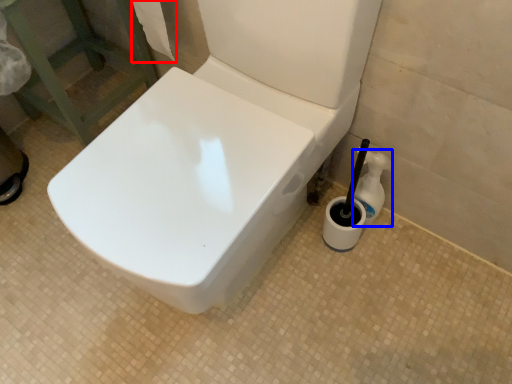
Question: Which of the following is the farthest to the observer, toilet paper (highlighted by a red box) or cleaning product (highlighted by a blue box)?

Choices:
 (A) toilet paper
 (B) cleaning product

Answer: (B)